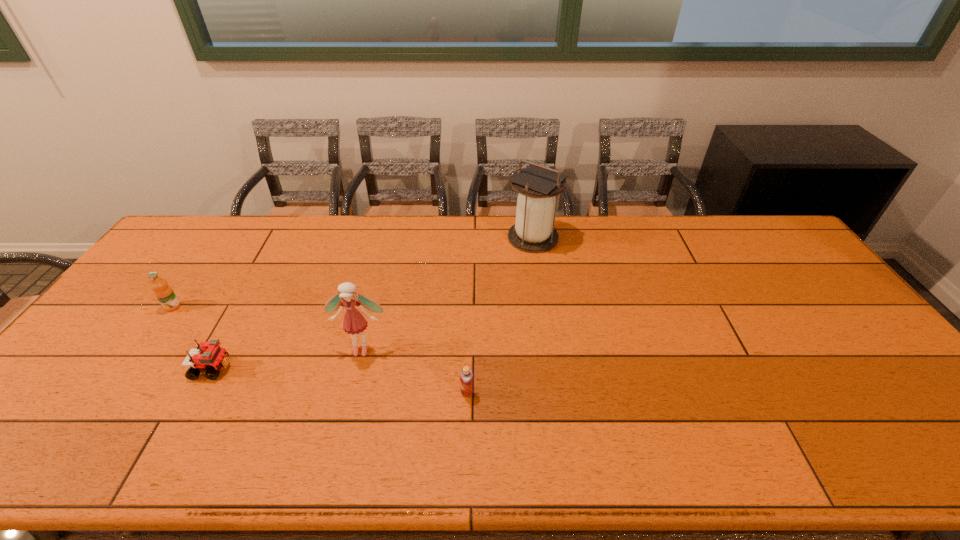
Locate an element on the screen. This screenshot has height=540, width=960. lantern is located at coordinates click(x=533, y=232).

Locate an element on the screen. The height and width of the screenshot is (540, 960). the rightmost object is located at coordinates (533, 232).

What are the coordinates of `doll` in the screenshot? It's located at (354, 322).

You are a GUI agent. You are given a task and a screenshot of the screen. Output one action in this format:
    pyautogui.click(x=<x>, y=<y>)
    Task: Click on the fourth shortest object
    The image size is (960, 540).
    Given the screenshot: What is the action you would take?
    pyautogui.click(x=354, y=322)

Locate an element on the screen. The image size is (960, 540). the third tallest object is located at coordinates 164,293.

Identify the location of the leftmost object. (164, 293).

In order to click on the second object from right to left in this screenshot , I will do `click(466, 376)`.

Locate an element on the screen. This screenshot has height=540, width=960. the shorter orange juice is located at coordinates (466, 376).

At what (x,y) coordinates should I click in order to perform the action: click on the second object from left to right. Please return your answer as a coordinate pair (x, y). The height and width of the screenshot is (540, 960). Looking at the image, I should click on point(209,356).

The width and height of the screenshot is (960, 540). What are the coordinates of `vacant space situated 0.370m on the front of the lantern` in the screenshot? It's located at coord(548,341).